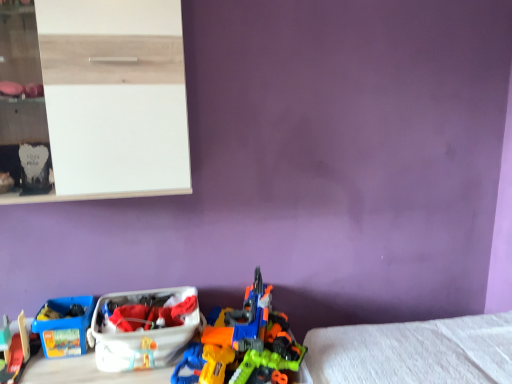
The width and height of the screenshot is (512, 384). I want to click on vacant space in between smooth plastic toy train at lower left, the 2th toy when ordered from right to left, and blue plastic storage box at lower left, which is the 2th storage box in right-to-left order, so click(x=55, y=368).